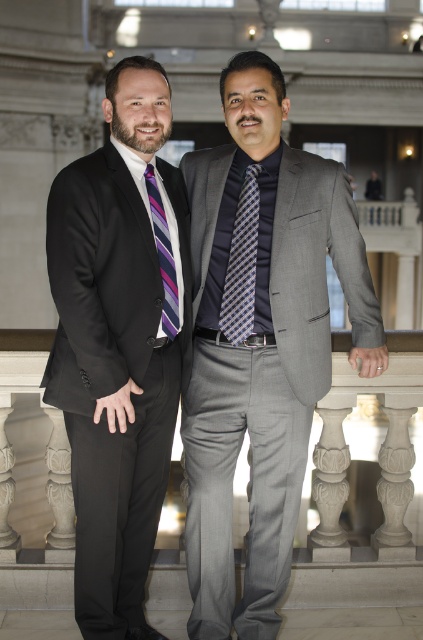
Question: Which object is the farthest from the plaid silk tie at center?

Choices:
 (A) matte black suit at left
 (B) purple striped tie at left

Answer: (A)

Question: Observing the image, what is the correct spatial positioning of matte black suit at left in reference to purple striped tie at left?

Choices:
 (A) left
 (B) right

Answer: (A)

Question: Among these objects, which one is nearest to the camera?

Choices:
 (A) plaid silk tie at center
 (B) purple striped tie at left
 (C) matte black suit at left

Answer: (C)

Question: Is plaid silk tie at center wider than purple striped tie at left?

Choices:
 (A) no
 (B) yes

Answer: (B)

Question: Which of the following is the farthest from the observer?

Choices:
 (A) plaid silk tie at center
 (B) purple striped tie at left
 (C) matte black suit at left

Answer: (A)

Question: Observing the image, what is the correct spatial positioning of matte black suit at left in reference to purple striped tie at left?

Choices:
 (A) below
 (B) above

Answer: (A)